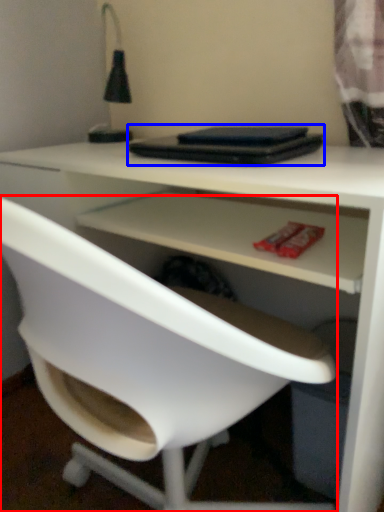
Question: Which of the following is the closest to the observer, chair (highlighted by a red box) or laptop (highlighted by a blue box)?

Choices:
 (A) chair
 (B) laptop

Answer: (A)